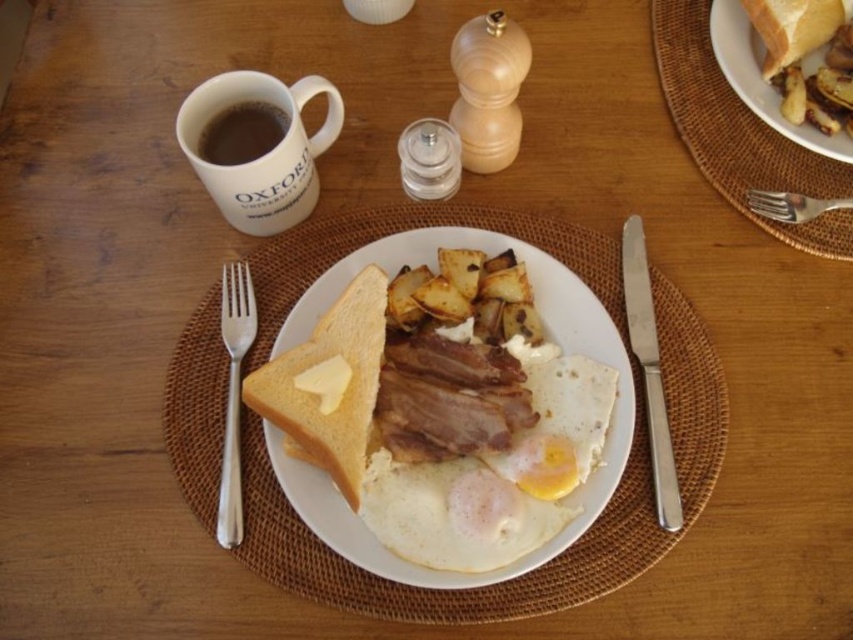
Does white glossy plate at center have a smaller size compared to butter-toasted bread at center-left?

No.

The image size is (853, 640). What are the coordinates of `white glossy plate at center` in the screenshot? It's located at (549, 337).

Between point (625, 374) and point (293, 413), which one is positioned in front?

Positioned in front is point (293, 413).

Where is `white glossy plate at center`? white glossy plate at center is located at coordinates (549, 337).

This screenshot has width=853, height=640. Describe the element at coordinates (648, 371) in the screenshot. I see `satin silver knife at right` at that location.

I want to click on satin silver knife at right, so click(648, 371).

In the scene shown: Is the position of satin silver knife at right less distant than that of dark matte mug at upper left?

Yes, it is.

The width and height of the screenshot is (853, 640). Identify the location of satin silver knife at right. (648, 371).

The width and height of the screenshot is (853, 640). Identify the location of satin silver knife at right. (648, 371).